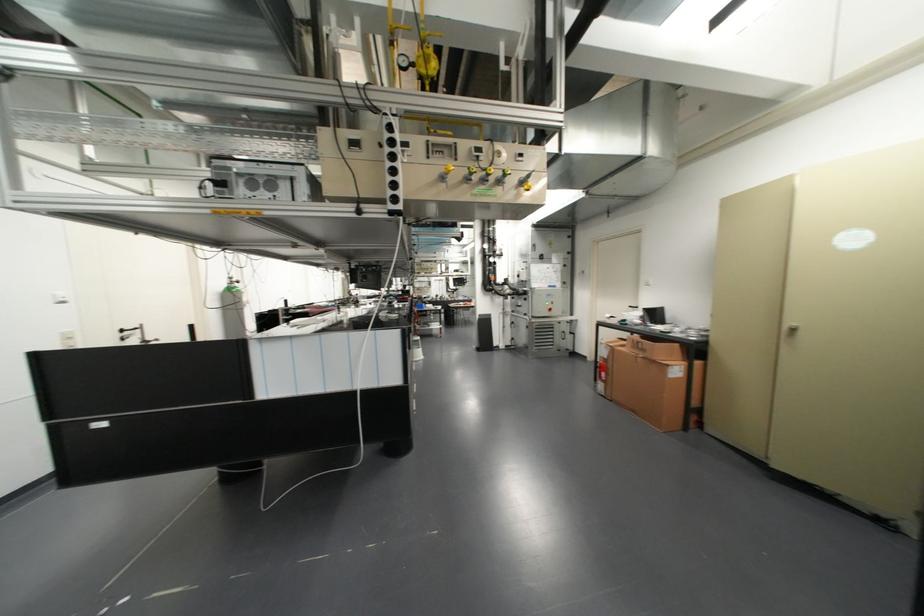
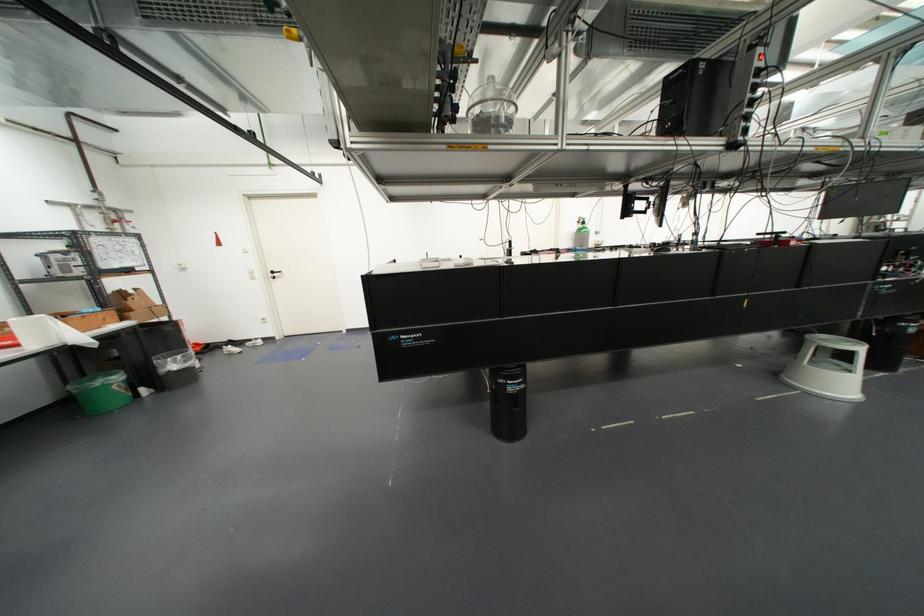
Locate, in the second image, the point that corresponds to the point at 418,354 in the first image.

(834, 384)